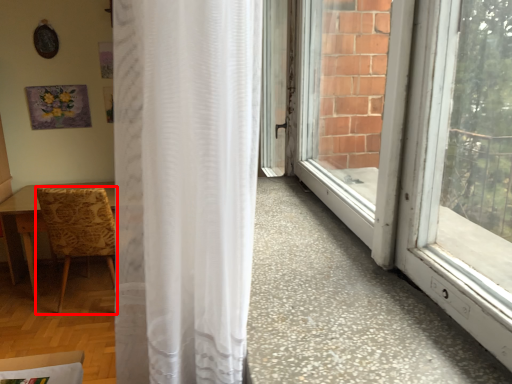
Question: Considering the relative positions of chair (annotated by the red box) and curtain in the image provided, where is chair (annotated by the red box) located with respect to the staircase?

Choices:
 (A) left
 (B) right

Answer: (A)